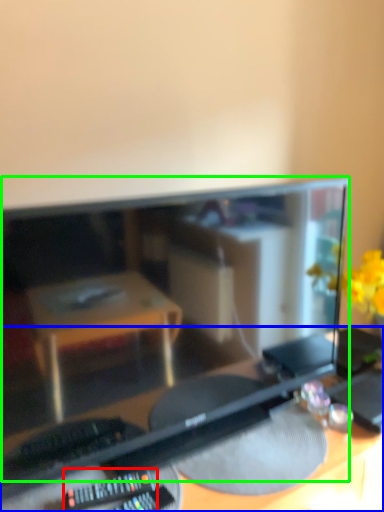
Question: Which object is positioned closest to control (highlighted by a red box)? Select from desk (highlighted by a blue box) and computer monitor (highlighted by a green box).

Choices:
 (A) desk
 (B) computer monitor

Answer: (A)